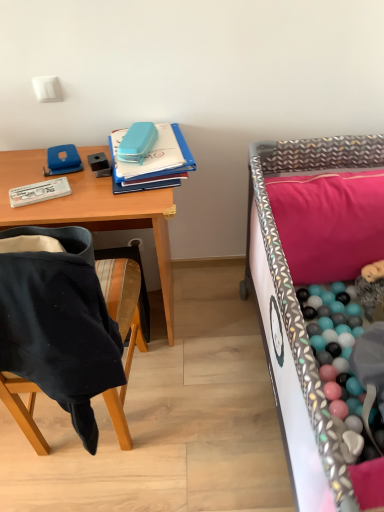
Question: Looking at their shapes, would you say blue plastic notebook at upper center is wider or thinner than wooden desk at upper left?

Choices:
 (A) thin
 (B) wide

Answer: (A)

Question: In terms of height, does blue plastic notebook at upper center look taller or shorter compared to wooden desk at upper left?

Choices:
 (A) short
 (B) tall

Answer: (A)

Question: Which object is the closest to the blue plastic notebook at upper center?

Choices:
 (A) black fabric chair at left
 (B) wooden desk at upper left
 (C) patterned fabric infant bed at right
 (D) pink fabric pillow at upper right

Answer: (B)

Question: Which of these objects is positioned closest to the patterned fabric infant bed at right?

Choices:
 (A) black fabric chair at left
 (B) pink fabric pillow at upper right
 (C) blue plastic notebook at upper center
 (D) wooden desk at upper left

Answer: (B)